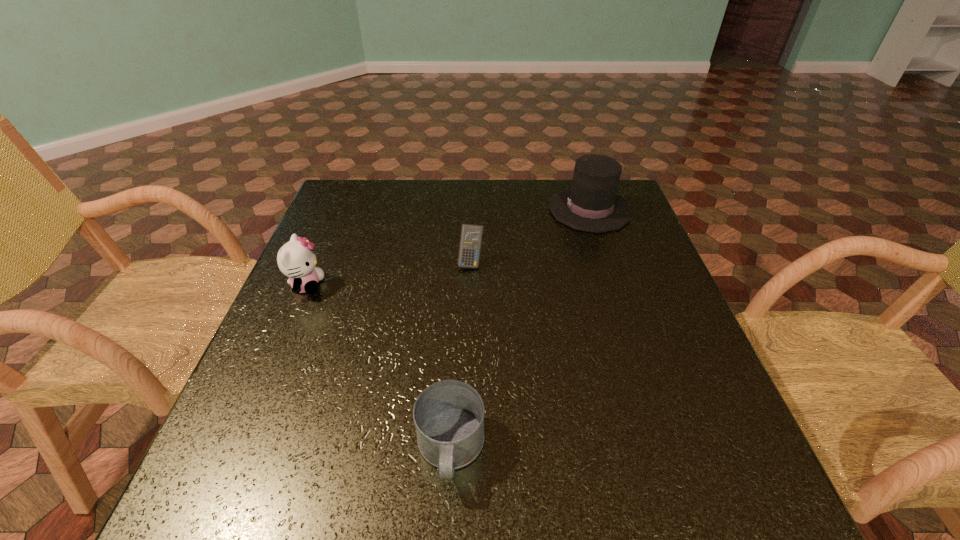
Locate an element on the screen. The width and height of the screenshot is (960, 540). the rightmost object is located at coordinates (591, 204).

Find the location of `the farthest object`. the farthest object is located at coordinates (591, 204).

This screenshot has width=960, height=540. What are the coordinates of `the leftmost object` in the screenshot? It's located at (296, 259).

You are a GUI agent. You are given a task and a screenshot of the screen. Output one action in this format:
    pyautogui.click(x=<x>, y=<y>)
    Task: Click on the calculator
    The width and height of the screenshot is (960, 540).
    Given the screenshot: What is the action you would take?
    pyautogui.click(x=471, y=236)

Find the location of a particular element. mug is located at coordinates (448, 415).

Locate an element on the screen. This screenshot has height=540, width=960. the nearest object is located at coordinates (448, 415).

Where is `vacant area situated on the front of the dress hat with the decoration`? The height and width of the screenshot is (540, 960). vacant area situated on the front of the dress hat with the decoration is located at coordinates (484, 210).

This screenshot has height=540, width=960. I want to click on free region located on the front of the dress hat with the decoration, so click(422, 210).

Where is `vacant space located 0.150m on the front of the dress hat with the decoration`? vacant space located 0.150m on the front of the dress hat with the decoration is located at coordinates (497, 210).

Identify the location of free spot located 0.070m on the front-facing side of the kitten. (353, 286).